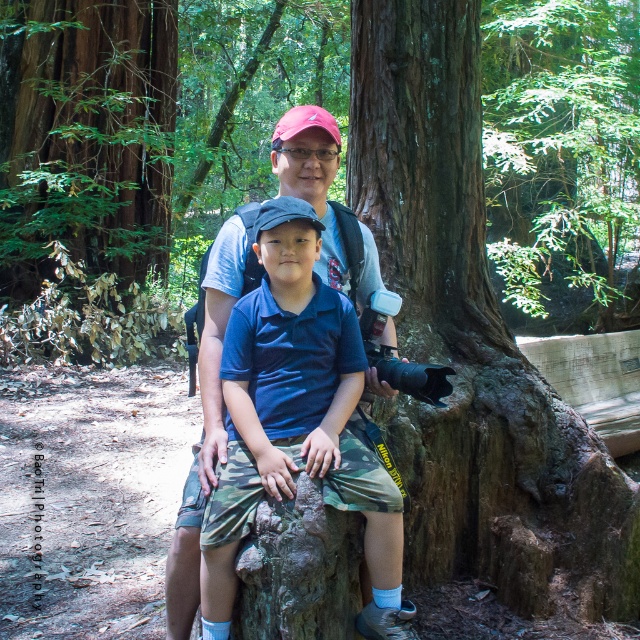
You are a photographer trying to capture the brown rough tree trunk at center in your shot. If your camera has a focus point at the center of the image, which is at coordinate point 0.5, 0.5, will the trunk be in focus?

The brown rough tree trunk at center is positioned at point (472,339), which is slightly to the right and below the camera focus point at (320,320). Therefore, it will not be in focus.

You are a photographer standing in the forest scene. You notice two points marked in the image. Which point is closer to you, point at coordinates (492, 161) or point at coordinates (12, 253)?

Point at coordinates (492, 161) is further to the viewer than point at coordinates (12, 253), so the point at coordinates (12, 253) is closer to you.

You are planning to hang a birdhouse between the green leafy tree at upper center and the green rough bark tree at upper left. Considering their widths, which tree would allow the birdhouse to be placed closer to the center of the image?

The green leafy tree at upper center has a larger width than the green rough bark tree at upper left, so placing the birdhouse closer to the center of the image would be better near the green leafy tree at upper center because its greater width provides more space in the middle area.